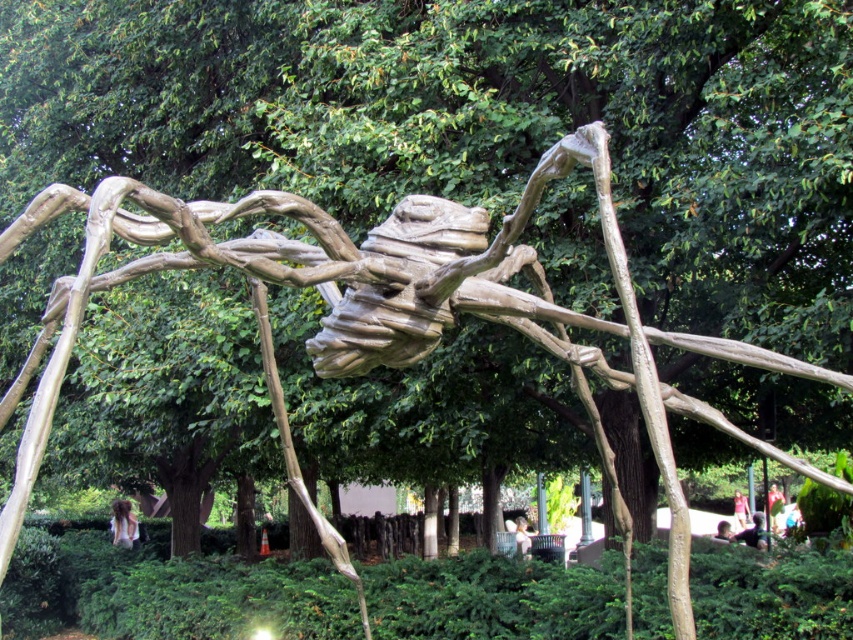
You are a photographer positioned at the center of the scene. You want to capture a closeup of the brown hair at lower left without including any of the spider sculpture in the frame. Is this possible given the current composition?

The brown hair at lower left is located at point [123,524], which is outside the area occupied by the spider sculpture. Therefore, it is possible to capture a closeup of the brown hair at lower left without including the spider sculpture in the frame.

You are standing in front of the spider sculpture and want to take a photo. You notice two points on the sculpture labeled as point (x=109, y=520) and point (x=758, y=522). Which point is closer to your camera lens?

Point (x=109, y=520) is further to the camera than point (x=758, y=522), so the point closer to the camera lens is point (x=758, y=522).

You are an artist planning to photograph the white fabric person at center and the yellow fabric dress at center in the sculpture garden. Based on their sizes, which one would appear closer to the camera in the photo?

The white fabric person at center is bigger than the yellow fabric dress at center, so it would appear closer to the camera in the photo.